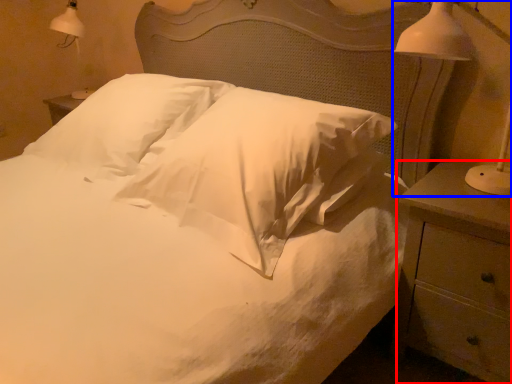
Question: Which object appears closest to the camera in this image, nightstand (highlighted by a red box) or bedside lamp (highlighted by a blue box)?

Choices:
 (A) nightstand
 (B) bedside lamp

Answer: (B)